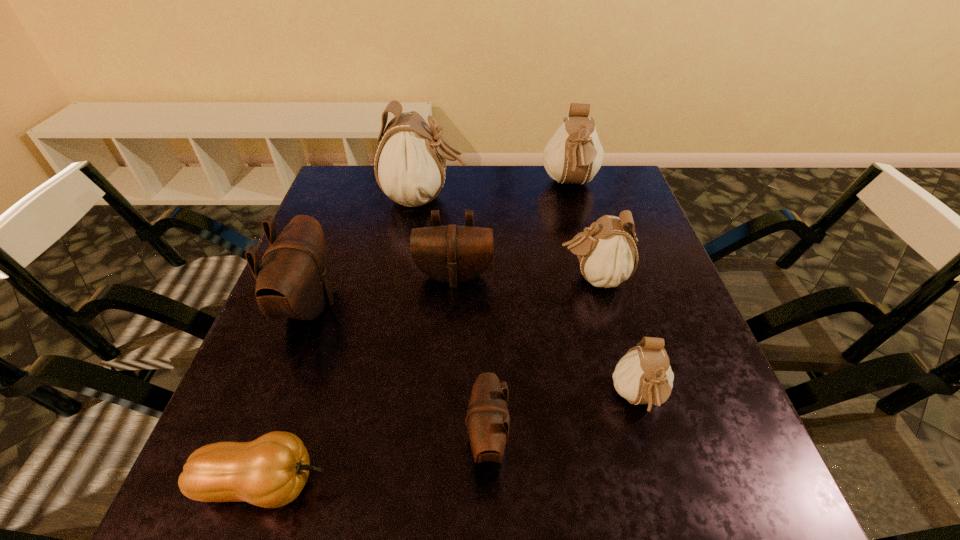
Point out which brown pouch is positioned as the nearest to the second biggest white pouch. Please provide its 2D coordinates. Your answer should be formatted as a tuple, i.e. [(x, y)], where the tuple contains the x and y coordinates of a point satisfying the conditions above.

[(453, 254)]

Locate an element on the screen. vacant space that satisfies the following two spatial constraints: 1. on the front-facing side of the third smallest white pouch; 2. on the front-facing side of the second nearest white pouch is located at coordinates (595, 278).

Identify the location of free space that satisfies the following two spatial constraints: 1. with the flap open on the second smallest brown pouch; 2. with the flap open on the biggest brown pouch. (452, 304).

Find the location of a particular element. This screenshot has width=960, height=540. free space that satisfies the following two spatial constraints: 1. on the front-facing side of the nearest white pouch; 2. with the flap open on the nearest brown pouch is located at coordinates (650, 438).

Identify the location of vacant space that satisfies the following two spatial constraints: 1. with the flap open on the second biggest brown pouch; 2. on the stem side of the gourd. This screenshot has height=540, width=960. (442, 484).